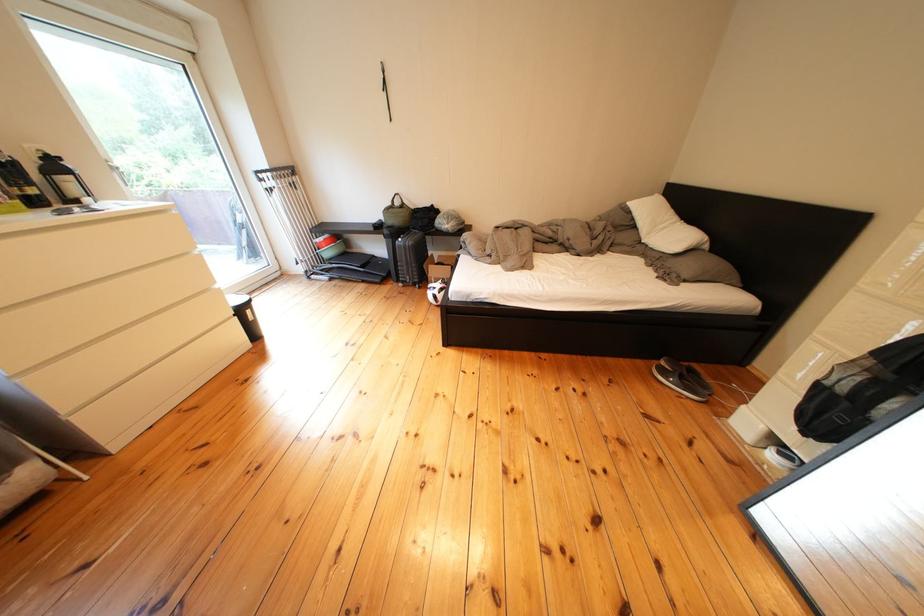
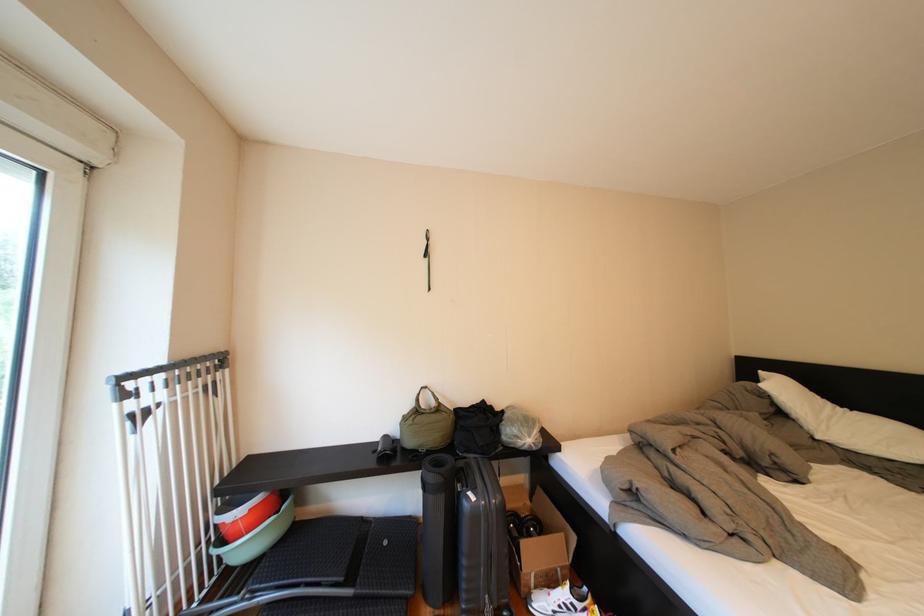
The point at [302,177] is marked in the first image. Where is the corresponding point in the second image?

(224, 369)